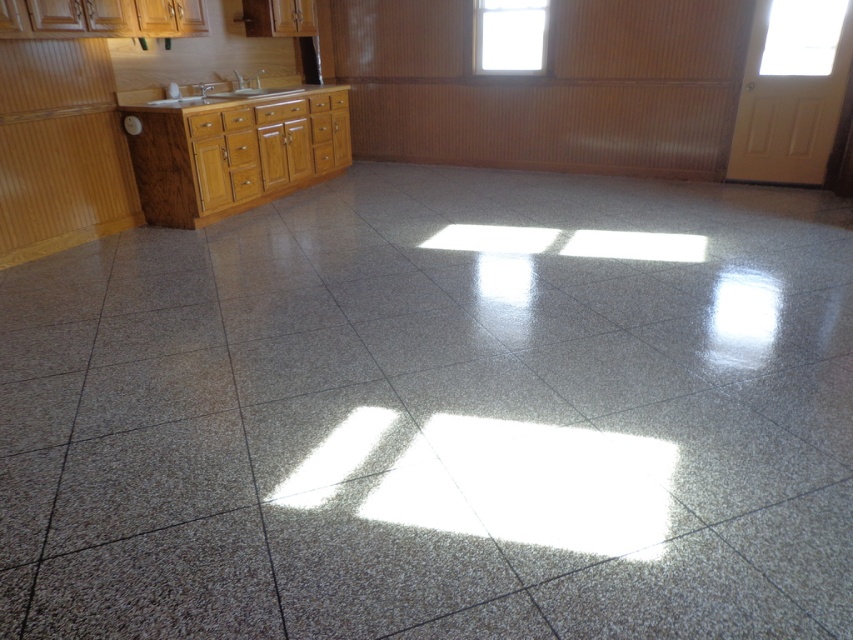
Question: Does wooden cabinet at left have a smaller size compared to transparent glass door at upper right?

Choices:
 (A) yes
 (B) no

Answer: (B)

Question: From the image, what is the correct spatial relationship of white glossy countertop at upper left in relation to matte silver sink at upper left?

Choices:
 (A) right
 (B) left

Answer: (B)

Question: Which object is farther from the camera taking this photo?

Choices:
 (A) transparent glass window at upper center
 (B) white glossy countertop at upper left
 (C) transparent glass door at upper right

Answer: (A)

Question: Is transparent glass door at upper right above matte silver sink at upper left?

Choices:
 (A) no
 (B) yes

Answer: (B)

Question: Which point is farther from the camera taking this photo?

Choices:
 (A) (134, 106)
 (B) (476, 49)
 (C) (241, 88)

Answer: (B)

Question: Among these points, which one is farthest from the camera?

Choices:
 (A) (509, 22)
 (B) (318, 84)
 (C) (252, 88)
 (D) (161, 189)

Answer: (A)